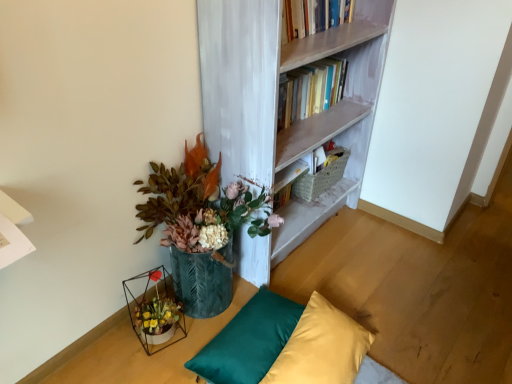
At what (x,y) coordinates should I click in order to perform the action: click on vacant area that is in front of white painted wood bookcase at upper center. Please return your answer as a coordinate pair (x, y). The width and height of the screenshot is (512, 384). Looking at the image, I should click on (349, 297).